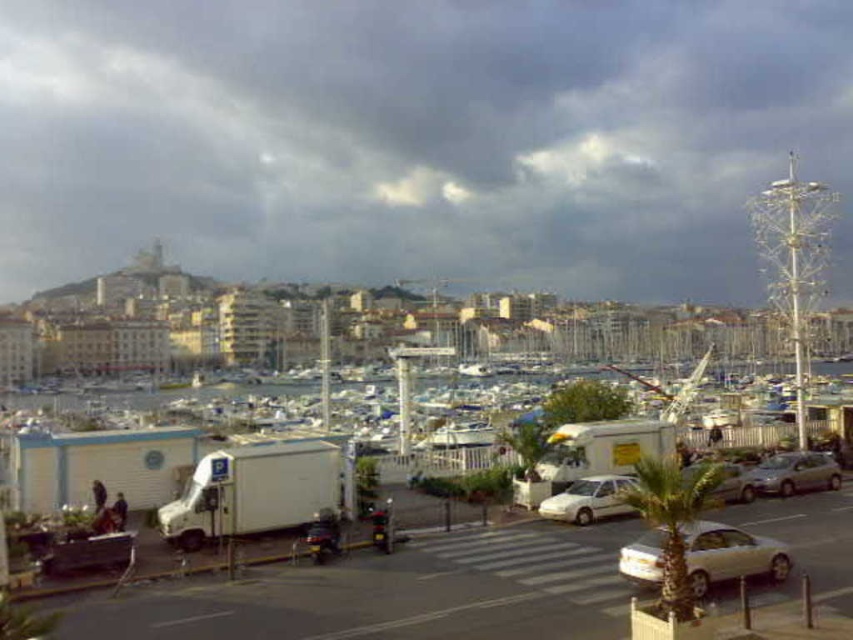
You are standing at the harbor and want to take a photo that includes both the white truck and the white van. Which of the two points, point (300, 464) or point (780, 467), would be closer to your camera position?

Point (300, 464) is closer to the camera than point (780, 467).

Consider the image. You are driving a car that requires a parking space of at least 8 meters. You see the white glossy car at lower right and the white matte car at center. Can you park your car between them?

The distance between the white glossy car at lower right and the white matte car at center is 7.88 meters, which is slightly less than the required 8 meters. Therefore, you cannot park your car between them.

You are a pedestrian standing on the street and see the white glossy car at lower right and the white matte car at center. Which car is positioned higher relative to the other?

The white glossy car at lower right is located above the white matte car at center, so it is positioned higher.